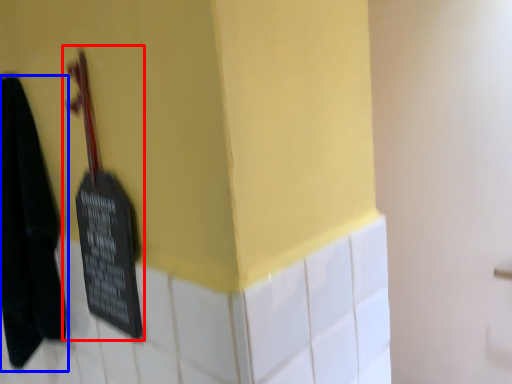
Question: Which object appears closest to the camera in this image, violin (highlighted by a red box) or towel (highlighted by a blue box)?

Choices:
 (A) violin
 (B) towel

Answer: (A)